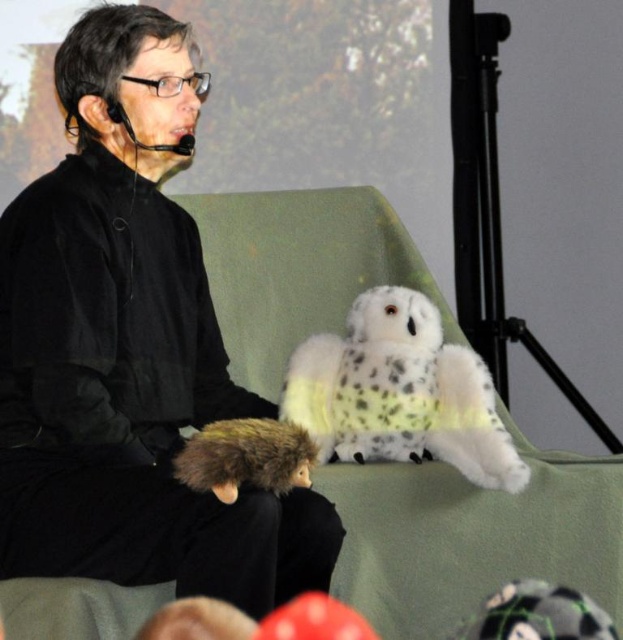
Question: From the image, what is the correct spatial relationship of black matte plush toy at center in relation to white fluffy owl at center?

Choices:
 (A) above
 (B) below

Answer: (A)

Question: Estimate the real-world distances between objects in this image. Which object is closer to the black matte plush toy at center?

Choices:
 (A) white fluffy owl at center
 (B) green fabric armchair at center

Answer: (A)

Question: Is green fabric armchair at center closer to camera compared to white fluffy owl at center?

Choices:
 (A) yes
 (B) no

Answer: (B)

Question: Observing the image, what is the correct spatial positioning of green fabric armchair at center in reference to white fluffy owl at center?

Choices:
 (A) right
 (B) left

Answer: (B)

Question: Which of these objects is positioned closest to the black matte plush toy at center?

Choices:
 (A) green fabric armchair at center
 (B) white fluffy owl at center

Answer: (B)

Question: Estimate the real-world distances between objects in this image. Which object is closer to the black matte plush toy at center?

Choices:
 (A) white fluffy owl at center
 (B) green fabric armchair at center

Answer: (A)